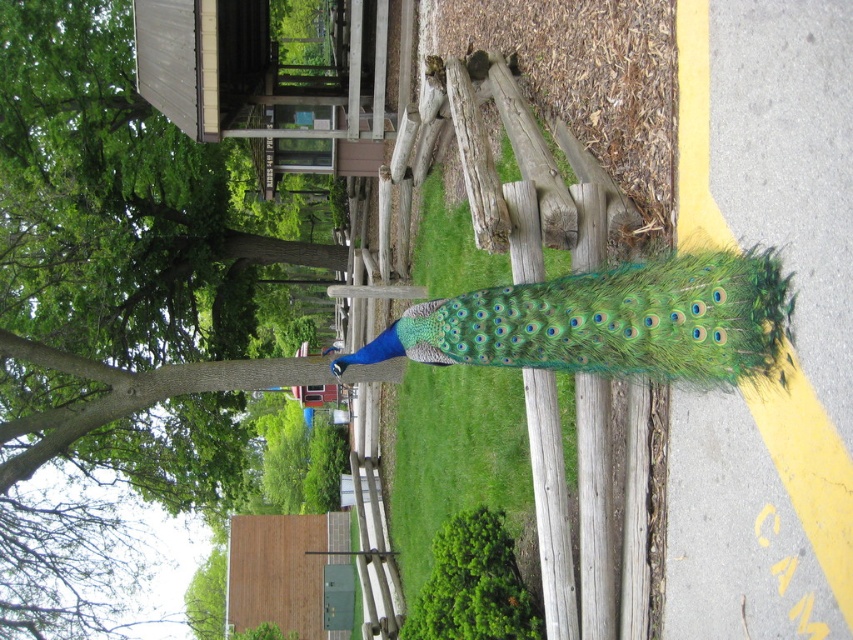
Question: Among these objects, which one is farthest from the camera?

Choices:
 (A) green leafy tree at center
 (B) green leafy grass at center
 (C) green iridescent feathers at center

Answer: (A)

Question: Is green leafy grass at center closer to the viewer compared to green iridescent feathers at center?

Choices:
 (A) yes
 (B) no

Answer: (B)

Question: Which point appears farthest from the camera in this image?

Choices:
 (A) (50, 588)
 (B) (691, 312)

Answer: (A)

Question: Is green leafy grass at center further to the viewer compared to green iridescent feathers at center?

Choices:
 (A) yes
 (B) no

Answer: (A)

Question: Which of these objects is positioned farthest from the green leafy tree at center?

Choices:
 (A) green leafy grass at center
 (B) green iridescent feathers at center

Answer: (B)

Question: Is the position of green leafy grass at center less distant than that of green iridescent feathers at center?

Choices:
 (A) yes
 (B) no

Answer: (B)